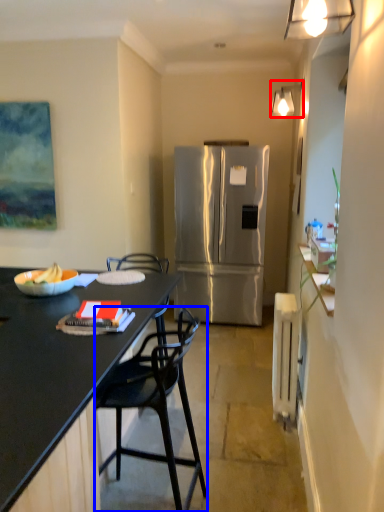
Question: Which point is closer to the camera, lamp (highlighted by a red box) or chair (highlighted by a blue box)?

Choices:
 (A) lamp
 (B) chair

Answer: (B)